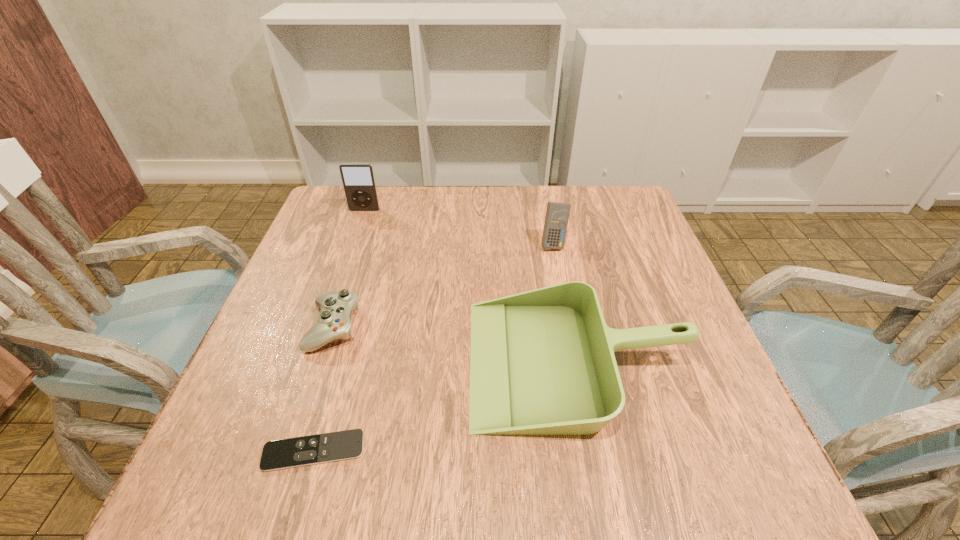
What are the coordinates of `object located at the near left corner` in the screenshot? It's located at [x=314, y=449].

Where is `vacant region at the far edge of the desktop`? vacant region at the far edge of the desktop is located at coordinates (459, 207).

In order to click on free spot at the near edge of the desktop in this screenshot , I will do `click(342, 488)`.

In the image, there is a desktop. Where is `free region at the right edge`? free region at the right edge is located at coordinates (650, 304).

Image resolution: width=960 pixels, height=540 pixels. Find the location of `blank area at the far left corner`. blank area at the far left corner is located at coordinates [x=311, y=229].

In the image, there is a desktop. Where is `free space at the far right corner`? free space at the far right corner is located at coordinates (622, 211).

Image resolution: width=960 pixels, height=540 pixels. Identify the location of blank region between the fourth nearest object and the shortest object. coord(434,348).

Locate an element on the screen. free point between the control and the remote control is located at coordinates (324, 389).

Locate an element on the screen. empty location between the iPod and the second farthest object is located at coordinates (459, 227).

The width and height of the screenshot is (960, 540). What are the coordinates of `free space between the farthest object and the second shortest object` in the screenshot? It's located at (349, 268).